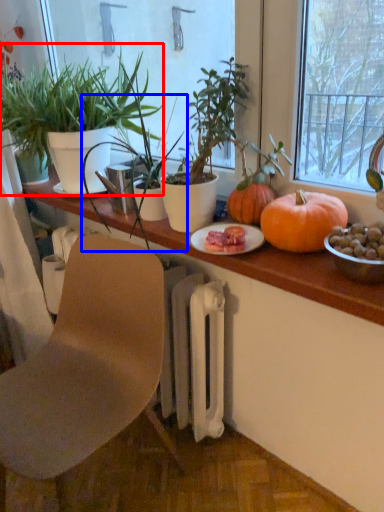
Question: Among these objects, which one is nearest to the camera, houseplant (highlighted by a red box) or houseplant (highlighted by a blue box)?

Choices:
 (A) houseplant
 (B) houseplant

Answer: (B)